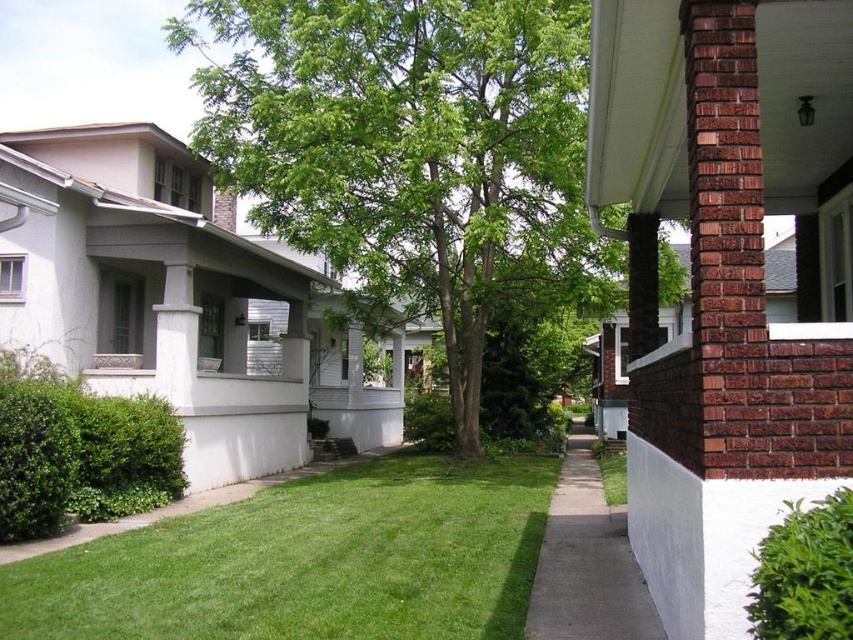
Question: Among these points, which one is farthest from the camera?

Choices:
 (A) (161, 632)
 (B) (482, 330)

Answer: (B)

Question: Is green leafy tree at center behind green grass at lower center?

Choices:
 (A) no
 (B) yes

Answer: (B)

Question: Does green leafy tree at center have a smaller size compared to gray concrete sidewalk at lower center?

Choices:
 (A) no
 (B) yes

Answer: (A)

Question: Which of the following is the farthest from the observer?

Choices:
 (A) (212, 609)
 (B) (479, 176)
 (C) (570, 483)

Answer: (C)

Question: Is green leafy tree at center wider than gray concrete sidewalk at lower center?

Choices:
 (A) no
 (B) yes

Answer: (B)

Question: Which of the following is the farthest from the observer?

Choices:
 (A) (549, 561)
 (B) (358, 116)

Answer: (B)